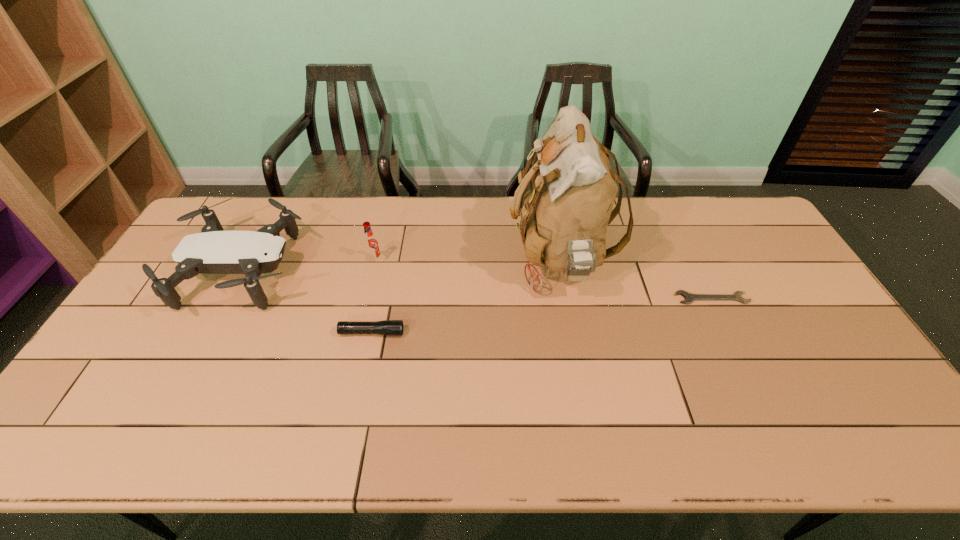
I want to click on vacant space located on the front-facing side of the backpack, so click(x=492, y=261).

Locate an element on the screen. vacant space located on the back of the root beer is located at coordinates (390, 198).

Locate an element on the screen. vacant space situated on the camera side of the leftmost object is located at coordinates (336, 271).

Identify the location of vacant point located at the lens end of the flashlight. (440, 333).

Locate an element on the screen. This screenshot has width=960, height=540. blank space located 0.130m on the front of the rightmost object is located at coordinates (732, 342).

Image resolution: width=960 pixels, height=540 pixels. Identify the location of backpack located in the far edge section of the desktop. (566, 199).

At what (x,y) coordinates should I click in order to perform the action: click on drone that is at the far edge. Please return your answer as a coordinate pair (x, y). The image size is (960, 540). Looking at the image, I should click on (213, 251).

The width and height of the screenshot is (960, 540). What are the coordinates of `object that is positioned at the left edge` in the screenshot? It's located at (213, 251).

Locate an element on the screen. Image resolution: width=960 pixels, height=540 pixels. object that is positioned at the far left corner is located at coordinates (213, 251).

Locate an element on the screen. This screenshot has height=540, width=960. free point at the far edge is located at coordinates (251, 230).